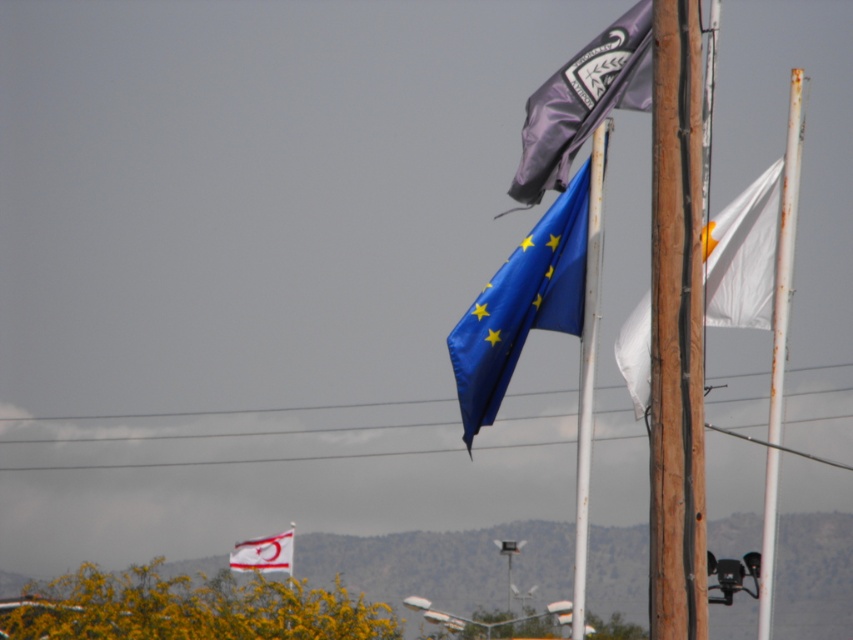
You are a photographer setting up a shot of the wooden pole at right and the white fabric flag at lower center. To ensure both are in focus, you need to know which object is closer to you. Can you determine which is nearer?

The wooden pole at right has a larger size compared to the white fabric flag at lower center, so the wooden pole at right is closer to you because larger objects in a scene typically appear closer than smaller ones.

You are an engineer inspecting the electrical setup. You notice the wooden pole at right and the metallic wire at upper center. Which object is narrower in width?

The wooden pole at right has a lesser width compared to metallic wire at upper center, so the wooden pole at right is narrower.

Based on the scene described, which object is taller between the wooden pole at right and the metallic wire at upper center?

The wooden pole at right is much taller than the metallic wire at upper center.